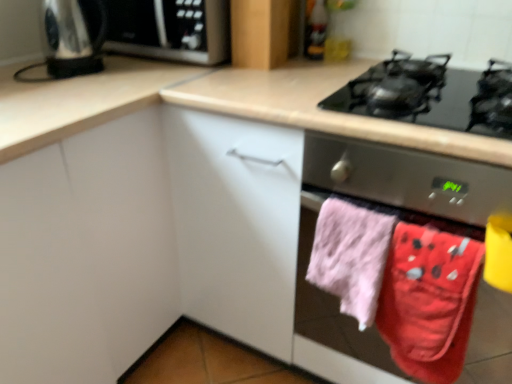
The image size is (512, 384). Find the location of `satin silver microwave at upper left`. satin silver microwave at upper left is located at coordinates (169, 29).

This screenshot has height=384, width=512. Describe the element at coordinates (264, 32) in the screenshot. I see `matte wood cabinet at upper center, the 1th cabinetry viewed from the back` at that location.

The height and width of the screenshot is (384, 512). I want to click on matte wood cabinet at upper center, the second cabinetry when ordered from front to back, so click(264, 32).

What do you see at coordinates (429, 300) in the screenshot? I see `red cotton beach towel at lower right, acting as the second beach towel starting from the left` at bounding box center [429, 300].

Where is `satin silver microwave at upper left`? The height and width of the screenshot is (384, 512). satin silver microwave at upper left is located at coordinates (169, 29).

Who is taller, white matte cabinet at center, which appears as the 1th cabinetry when viewed from the front, or red cotton beach towel at lower right, arranged as the 1th beach towel when viewed from the right?

With more height is white matte cabinet at center, which appears as the 1th cabinetry when viewed from the front.

Who is smaller, white matte cabinet at center, which appears as the 1th cabinetry when viewed from the front, or red cotton beach towel at lower right, arranged as the 1th beach towel when viewed from the right?

Smaller between the two is red cotton beach towel at lower right, arranged as the 1th beach towel when viewed from the right.

Relative to red cotton beach towel at lower right, arranged as the 1th beach towel when viewed from the right, is white matte cabinet at center, positioned as the second cabinetry in back-to-front order, in front or behind?

white matte cabinet at center, positioned as the second cabinetry in back-to-front order, is in front of red cotton beach towel at lower right, arranged as the 1th beach towel when viewed from the right.

Does white matte cabinet at center, which appears as the 1th cabinetry when viewed from the front, have a lesser width compared to red cotton beach towel at lower right, arranged as the 1th beach towel when viewed from the right?

No, white matte cabinet at center, which appears as the 1th cabinetry when viewed from the front, is not thinner than red cotton beach towel at lower right, arranged as the 1th beach towel when viewed from the right.

Which point is more forward, (432,123) or (284,40)?

Point (284,40)

Between black glass gas stove at upper right and matte wood cabinet at upper center, the 1th cabinetry viewed from the back, which one has smaller size?

Smaller between the two is matte wood cabinet at upper center, the 1th cabinetry viewed from the back.

From the image's perspective, would you say black glass gas stove at upper right is shown under matte wood cabinet at upper center, which is counted as the 2th cabinetry, starting from the left?

Indeed, from the image's perspective, black glass gas stove at upper right is shown beneath matte wood cabinet at upper center, which is counted as the 2th cabinetry, starting from the left.

Is shiny metallic kettle at upper left far from red cotton beach towel at lower right, arranged as the 1th beach towel when viewed from the right?

Yes.

Can you confirm if shiny metallic kettle at upper left is positioned to the right of red cotton beach towel at lower right, acting as the second beach towel starting from the left?

No.

Which object is closer to the camera, shiny metallic kettle at upper left or red cotton beach towel at lower right, acting as the second beach towel starting from the left?

red cotton beach towel at lower right, acting as the second beach towel starting from the left.

From the image's perspective, is shiny metallic kettle at upper left positioned above or below red cotton beach towel at lower right, acting as the second beach towel starting from the left?

Based on their image positions, shiny metallic kettle at upper left is located above red cotton beach towel at lower right, acting as the second beach towel starting from the left.

Based on the photo, what's the angular difference between satin silver microwave at upper left and shiny metallic kettle at upper left's facing directions?

The angle between the facing direction of satin silver microwave at upper left and the facing direction of shiny metallic kettle at upper left is 90 degrees.

Looking at this image, would you say satin silver microwave at upper left is outside shiny metallic kettle at upper left?

Yes.

Is satin silver microwave at upper left far away from shiny metallic kettle at upper left?

No, satin silver microwave at upper left is not far from shiny metallic kettle at upper left.

Is point (74, 39) behind point (82, 66)?

No.

Which object is wider, satin silver microwave at upper left or pink fabric oven mitts at lower right?

pink fabric oven mitts at lower right.

In the scene shown: Which point is more distant from viewer, (x=207, y=5) or (x=443, y=198)?

The point (x=207, y=5) is farther from the camera.

From the image's perspective, does satin silver microwave at upper left appear higher than pink fabric oven mitts at lower right?

Correct, satin silver microwave at upper left appears higher than pink fabric oven mitts at lower right in the image.

Is satin silver microwave at upper left shorter than pink fabric oven mitts at lower right?

Correct, satin silver microwave at upper left is not as tall as pink fabric oven mitts at lower right.

Does white matte cabinet at center, positioned as the second cabinetry in back-to-front order, have a lesser width compared to shiny metallic kettle at upper left?

Incorrect, the width of white matte cabinet at center, positioned as the second cabinetry in back-to-front order, is not less than that of shiny metallic kettle at upper left.

Is white matte cabinet at center, the first cabinetry positioned from the left, spatially inside shiny metallic kettle at upper left, or outside of it?

white matte cabinet at center, the first cabinetry positioned from the left, exists outside the volume of shiny metallic kettle at upper left.

Considering the positions of points (137, 285) and (54, 2), is point (137, 285) closer to camera compared to point (54, 2)?

No, (137, 285) is behind (54, 2).

Is the surface of red cotton beach towel at lower right, acting as the second beach towel starting from the left, in direct contact with pink fluffy towel at lower right, which is the 2th beach towel in right-to-left order?

No.

Considering the positions of objects red cotton beach towel at lower right, arranged as the 1th beach towel when viewed from the right, and pink fluffy towel at lower right, marked as the first beach towel in a left-to-right arrangement, in the image provided, who is behind, red cotton beach towel at lower right, arranged as the 1th beach towel when viewed from the right, or pink fluffy towel at lower right, marked as the first beach towel in a left-to-right arrangement,?

pink fluffy towel at lower right, marked as the first beach towel in a left-to-right arrangement, is further away from the camera.

Could you tell me if red cotton beach towel at lower right, arranged as the 1th beach towel when viewed from the right, is facing pink fluffy towel at lower right, marked as the first beach towel in a left-to-right arrangement?

No, red cotton beach towel at lower right, arranged as the 1th beach towel when viewed from the right, is not facing towards pink fluffy towel at lower right, marked as the first beach towel in a left-to-right arrangement.

Find the location of a particular element. This screenshot has height=384, width=512. the 1st beach towel behind the white matte cabinet at center, the first cabinetry positioned from the left, counting from the anchor's position is located at coordinates (429, 300).

What are the coordinates of `gas stove located in front of the matte wood cabinet at upper center, the 1th cabinetry viewed from the back` in the screenshot? It's located at (430, 95).

Which object lies further to the anchor point matte wood cabinet at upper center, the second cabinetry when ordered from front to back, pink fluffy towel at lower right, which is the 2th beach towel in right-to-left order, or satin silver microwave at upper left?

Among the two, pink fluffy towel at lower right, which is the 2th beach towel in right-to-left order, is located further to matte wood cabinet at upper center, the second cabinetry when ordered from front to back.

Which object lies further to the anchor point pink fabric oven mitts at lower right, red cotton beach towel at lower right, acting as the second beach towel starting from the left, or shiny metallic kettle at upper left?

shiny metallic kettle at upper left lies further to pink fabric oven mitts at lower right than the other object.

Looking at the image, which one is located closer to satin silver microwave at upper left, pink fabric oven mitts at lower right or red cotton beach towel at lower right, arranged as the 1th beach towel when viewed from the right?

pink fabric oven mitts at lower right.

Estimate the real-world distances between objects in this image. Which object is closer to shiny metallic kettle at upper left, pink fabric oven mitts at lower right or red cotton beach towel at lower right, arranged as the 1th beach towel when viewed from the right?

pink fabric oven mitts at lower right is closer to shiny metallic kettle at upper left.

Consider the image. Looking at the image, which one is located closer to red cotton beach towel at lower right, arranged as the 1th beach towel when viewed from the right, white matte cabinet at center, which appears as the 1th cabinetry when viewed from the front, or pink fluffy towel at lower right, marked as the first beach towel in a left-to-right arrangement?

pink fluffy towel at lower right, marked as the first beach towel in a left-to-right arrangement, is positioned closer to the anchor red cotton beach towel at lower right, arranged as the 1th beach towel when viewed from the right.

Estimate the real-world distances between objects in this image. Which object is further from black glass gas stove at upper right, pink fabric oven mitts at lower right or satin silver microwave at upper left?

satin silver microwave at upper left lies further to black glass gas stove at upper right than the other object.

Estimate the real-world distances between objects in this image. Which object is closer to matte wood cabinet at upper center, placed as the 1th cabinetry when sorted from right to left, pink fluffy towel at lower right, marked as the first beach towel in a left-to-right arrangement, or red cotton beach towel at lower right, acting as the second beach towel starting from the left?

The object closer to matte wood cabinet at upper center, placed as the 1th cabinetry when sorted from right to left, is pink fluffy towel at lower right, marked as the first beach towel in a left-to-right arrangement.

Looking at the image, which one is located closer to matte wood cabinet at upper center, the 1th cabinetry viewed from the back, shiny metallic kettle at upper left or pink fluffy towel at lower right, which is the 2th beach towel in right-to-left order?

Based on the image, shiny metallic kettle at upper left appears to be nearer to matte wood cabinet at upper center, the 1th cabinetry viewed from the back.

This screenshot has height=384, width=512. I want to click on beach towel between pink fluffy towel at lower right, marked as the first beach towel in a left-to-right arrangement, and pink fabric oven mitts at lower right, in the horizontal direction, so click(429, 300).

Find the location of `gas stove between matte wood cabinet at upper center, which is counted as the 2th cabinetry, starting from the left, and pink fabric oven mitts at lower right in the up-down direction`. gas stove between matte wood cabinet at upper center, which is counted as the 2th cabinetry, starting from the left, and pink fabric oven mitts at lower right in the up-down direction is located at coordinates (430, 95).

The height and width of the screenshot is (384, 512). Find the location of `home appliance between satin silver microwave at upper left and pink fluffy towel at lower right, marked as the first beach towel in a left-to-right arrangement, vertically`. home appliance between satin silver microwave at upper left and pink fluffy towel at lower right, marked as the first beach towel in a left-to-right arrangement, vertically is located at coordinates (388, 205).

Find the location of a particular element. gas stove between shiny metallic kettle at upper left and pink fabric oven mitts at lower right from left to right is located at coordinates (430, 95).